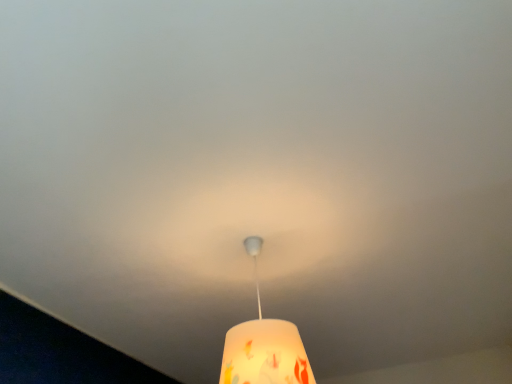
What do you see at coordinates (264, 345) in the screenshot?
I see `translucent painted lampshade at center` at bounding box center [264, 345].

Image resolution: width=512 pixels, height=384 pixels. Identify the location of translucent painted lampshade at center. (264, 345).

Find the location of `translucent painted lampshade at center`. translucent painted lampshade at center is located at coordinates (264, 345).